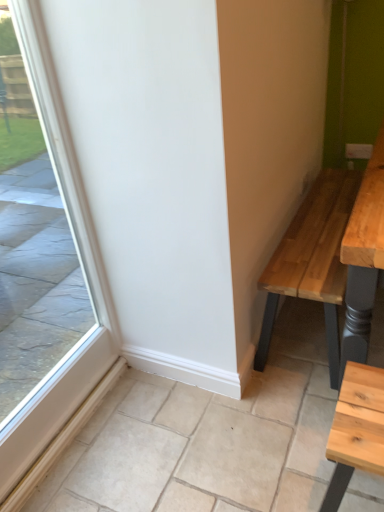
At what (x,y) coordinates should I click in order to perform the action: click on white glossy window at left. Please return your answer as a coordinate pair (x, y). Looking at the image, I should click on (34, 244).

The width and height of the screenshot is (384, 512). What do you see at coordinates (34, 244) in the screenshot? I see `white glossy window at left` at bounding box center [34, 244].

You are a GUI agent. You are given a task and a screenshot of the screen. Output one action in this format:
    pyautogui.click(x=<x>, y=<y>)
    Task: Click on the white glossy window at left
    The height and width of the screenshot is (512, 384).
    Given the screenshot: What is the action you would take?
    pyautogui.click(x=34, y=244)